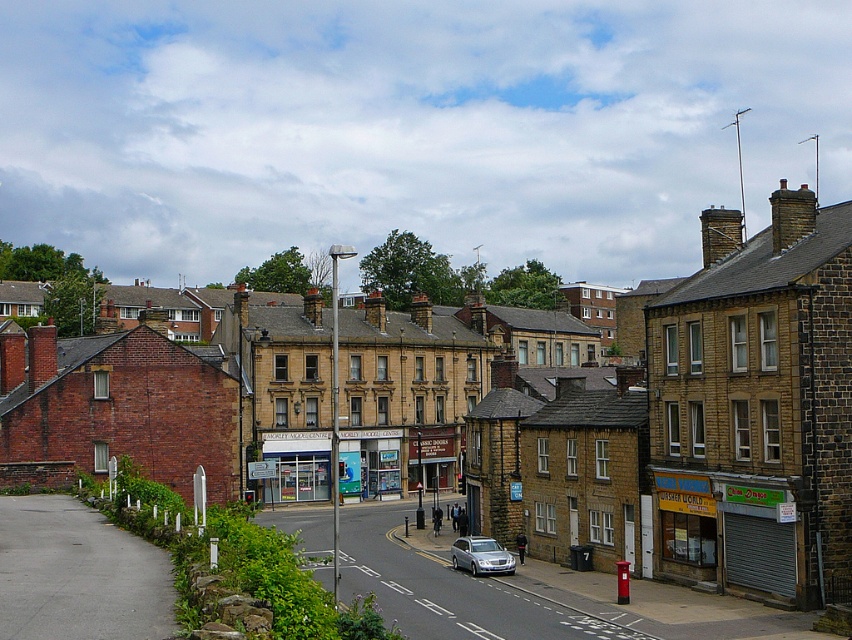
Is brown brick building at center positioned in front of silver metallic car at center?

Yes, it is in front of silver metallic car at center.

Can you confirm if brown brick building at center is positioned to the left of silver metallic car at center?

Incorrect, brown brick building at center is not on the left side of silver metallic car at center.

You are a GUI agent. You are given a task and a screenshot of the screen. Output one action in this format:
    pyautogui.click(x=<x>, y=<y>)
    Task: Click on the brown brick building at center
    This screenshot has width=852, height=640.
    Given the screenshot: What is the action you would take?
    point(755,406)